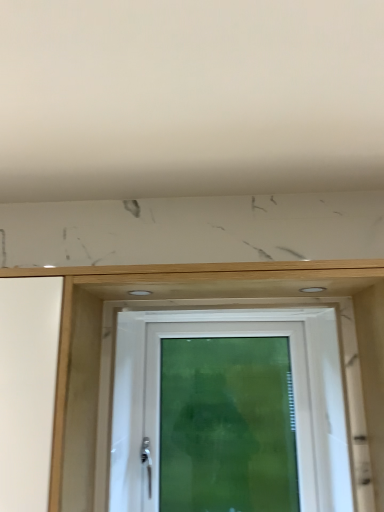
Question: From a real-world perspective, is white plastic door at center physically above white matte hole at upper center, which ranks as the first hole in left-to-right order?

Choices:
 (A) yes
 (B) no

Answer: (B)

Question: Are white plastic door at center and white matte hole at upper center, which ranks as the first hole in left-to-right order, making contact?

Choices:
 (A) no
 (B) yes

Answer: (A)

Question: Is white plastic door at center aimed at white matte hole at upper center, which ranks as the first hole in left-to-right order?

Choices:
 (A) no
 (B) yes

Answer: (B)

Question: Is white plastic door at center completely or partially outside of white matte hole at upper center, the 2th hole in the right-to-left sequence?

Choices:
 (A) yes
 (B) no

Answer: (A)

Question: From the image's perspective, would you say white plastic door at center is positioned over white matte hole at upper center, the 2th hole in the right-to-left sequence?

Choices:
 (A) yes
 (B) no

Answer: (B)

Question: From a real-world perspective, is white matte hole at upper center, the 2th hole in the right-to-left sequence, above or below white plastic door at center?

Choices:
 (A) above
 (B) below

Answer: (A)

Question: From the image's perspective, is white matte hole at upper center, which ranks as the first hole in left-to-right order, above or below white plastic door at center?

Choices:
 (A) below
 (B) above

Answer: (B)

Question: Based on their positions, is white matte hole at upper center, the 2th hole in the right-to-left sequence, located to the left or right of white plastic door at center?

Choices:
 (A) left
 (B) right

Answer: (A)

Question: In terms of height, does white matte hole at upper center, which ranks as the first hole in left-to-right order, look taller or shorter compared to white plastic door at center?

Choices:
 (A) tall
 (B) short

Answer: (B)

Question: Is white glossy screen door at center taller or shorter than white plastic door at center?

Choices:
 (A) tall
 (B) short

Answer: (B)

Question: Considering the positions of white glossy screen door at center and white plastic door at center in the image, is white glossy screen door at center bigger or smaller than white plastic door at center?

Choices:
 (A) big
 (B) small

Answer: (B)

Question: Would you say white glossy screen door at center is inside or outside white plastic door at center?

Choices:
 (A) inside
 (B) outside

Answer: (B)

Question: From a real-world perspective, is white glossy screen door at center above or below white plastic door at center?

Choices:
 (A) above
 (B) below

Answer: (A)

Question: Considering the positions of matte white hole at upper center, arranged as the first hole when viewed from the right, and white matte hole at upper center, which ranks as the first hole in left-to-right order, in the image, is matte white hole at upper center, arranged as the first hole when viewed from the right, wider or thinner than white matte hole at upper center, which ranks as the first hole in left-to-right order,?

Choices:
 (A) thin
 (B) wide

Answer: (B)

Question: In terms of height, does matte white hole at upper center, arranged as the first hole when viewed from the right, look taller or shorter compared to white matte hole at upper center, the 2th hole in the right-to-left sequence?

Choices:
 (A) tall
 (B) short

Answer: (B)